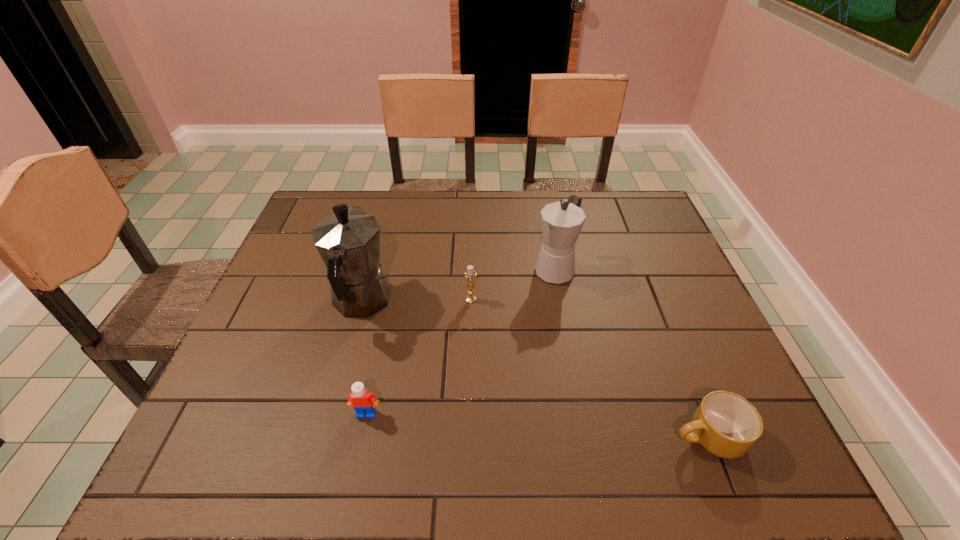
I want to click on vacant space located 0.240m on the pouring side of the taller coffeepot, so click(384, 219).

Find the location of a particular element. vacant area situated on the back of the right coffeepot is located at coordinates (540, 192).

Identify the location of vacant area located on the right of the candle holder. (558, 299).

Locate an element on the screen. Image resolution: width=960 pixels, height=540 pixels. blank space located 0.210m on the side with the handle of the shortest object is located at coordinates (564, 437).

Image resolution: width=960 pixels, height=540 pixels. Identify the location of vacant point located on the side with the handle of the shortest object. (507, 437).

This screenshot has width=960, height=540. I want to click on vacant space located on the side with the handle of the shortest object, so click(x=553, y=437).

Where is `object that is at the near edge`? The width and height of the screenshot is (960, 540). object that is at the near edge is located at coordinates (725, 424).

Identify the location of object situated at the right edge. This screenshot has height=540, width=960. pos(725,424).

Locate an element on the screen. The width and height of the screenshot is (960, 540). object that is at the near right corner is located at coordinates (725, 424).

Where is `blank space at the far edge`? This screenshot has height=540, width=960. blank space at the far edge is located at coordinates (436, 192).